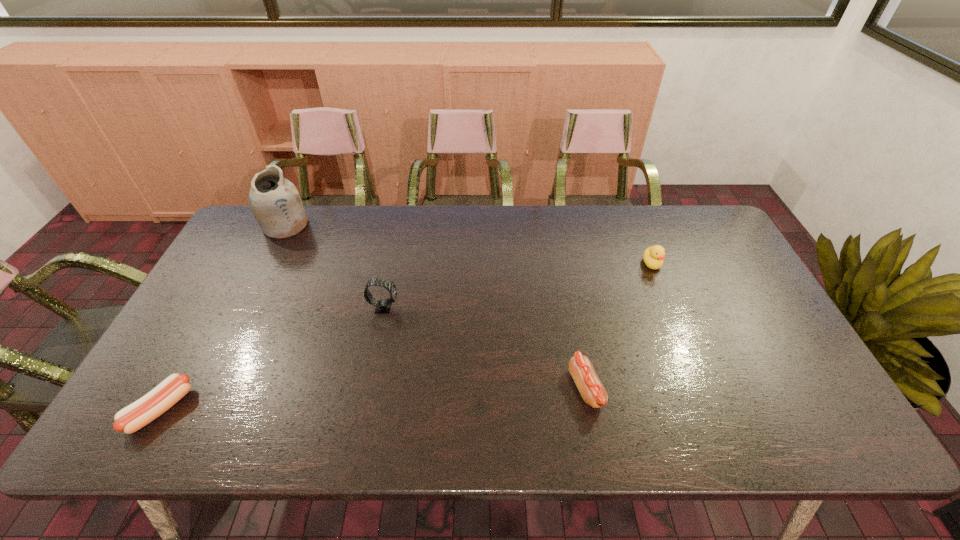
The height and width of the screenshot is (540, 960). Identify the location of free spot between the farthest object and the duckling. (468, 244).

Image resolution: width=960 pixels, height=540 pixels. Find the location of `unoccupied position between the farthest object and the duckling`. unoccupied position between the farthest object and the duckling is located at coordinates (468, 244).

This screenshot has width=960, height=540. I want to click on empty space between the fourth tallest object and the fourth nearest object, so click(618, 326).

What are the coordinates of `empty space between the third object from right to left and the shortest object` in the screenshot? It's located at (273, 358).

Locate which object is the third closest to the second tallest object. Please provide its 2D coordinates. Your answer should be formatted as a tuple, i.e. [(x, y)], where the tuple contains the x and y coordinates of a point satisfying the conditions above.

[(592, 391)]

This screenshot has width=960, height=540. In order to click on object that is the third closest one to the shortest object in this screenshot , I will do `click(592, 391)`.

I want to click on vacant region that satisfies the following two spatial constraints: 1. on the face of the watch; 2. on the left side of the taller sausage, so click(368, 389).

At what (x,y) coordinates should I click in order to perform the action: click on free point that satisfies the following two spatial constraints: 1. on the face of the third nearest object; 2. on the right side of the second shortest object. Please return your answer as a coordinate pair (x, y). Looking at the image, I should click on 368,389.

The height and width of the screenshot is (540, 960). What are the coordinates of `vacant region that satisfies the following two spatial constraints: 1. on the face of the third shortest object; 2. on the face of the fourth shortest object` in the screenshot? It's located at (669, 307).

Image resolution: width=960 pixels, height=540 pixels. I want to click on vacant space that satisfies the following two spatial constraints: 1. on the face of the watch; 2. on the back side of the right sausage, so pyautogui.click(x=368, y=389).